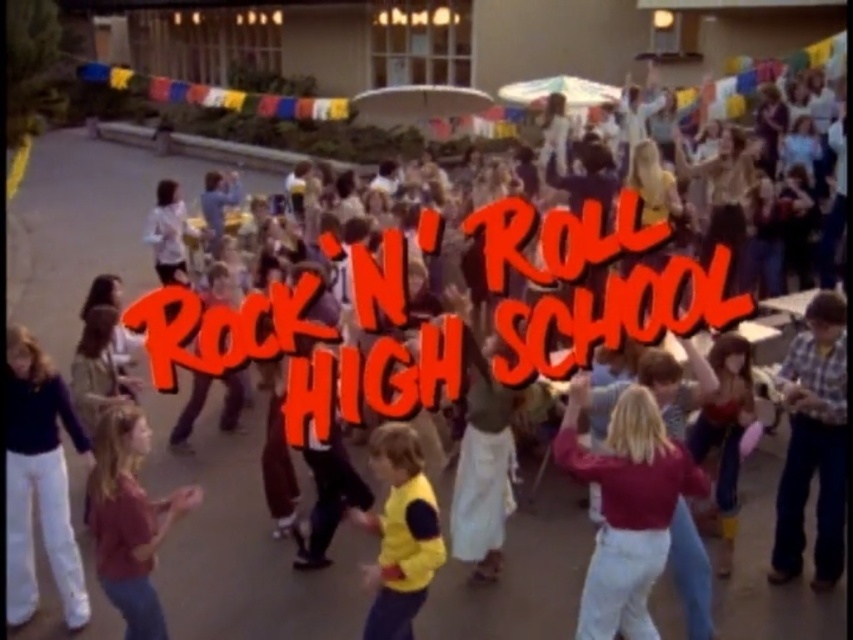
Is matte pink shirt at center thinner than yellow fleece vest at center?

No.

Does matte pink shirt at center have a lesser height compared to yellow fleece vest at center?

No, matte pink shirt at center is not shorter than yellow fleece vest at center.

Locate an element on the screen. matte pink shirt at center is located at coordinates (129, 518).

At what (x,y) coordinates should I click in order to perform the action: click on matte pink shirt at center. Please return your answer as a coordinate pair (x, y). The width and height of the screenshot is (853, 640). Looking at the image, I should click on coord(129,518).

Can you confirm if matte red sweater at center is wider than matte pink shirt at center?

Yes, matte red sweater at center is wider than matte pink shirt at center.

Does point (648, 448) come closer to viewer compared to point (171, 518)?

Yes.

Describe the element at coordinates (625, 508) in the screenshot. I see `matte red sweater at center` at that location.

Identify the location of matte red sweater at center. The image size is (853, 640). (625, 508).

Can you confirm if matte red sweater at center is thinner than yellow fleece vest at center?

No, matte red sweater at center is not thinner than yellow fleece vest at center.

Which is more to the left, matte red sweater at center or yellow fleece vest at center?

yellow fleece vest at center

Where is `matte red sweater at center`? This screenshot has height=640, width=853. matte red sweater at center is located at coordinates (625, 508).